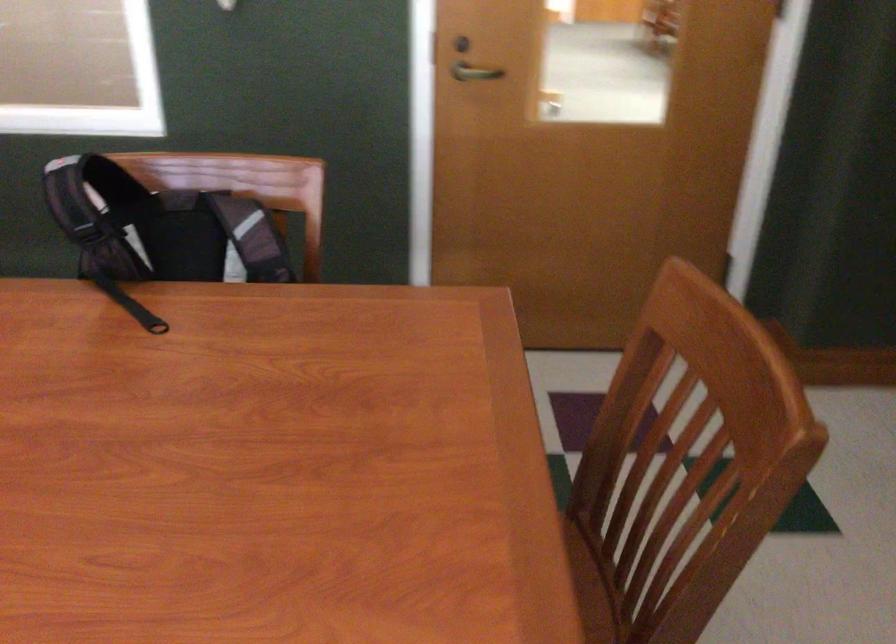
Locate an element on the screen. backpack shoulder strap is located at coordinates (159, 228).